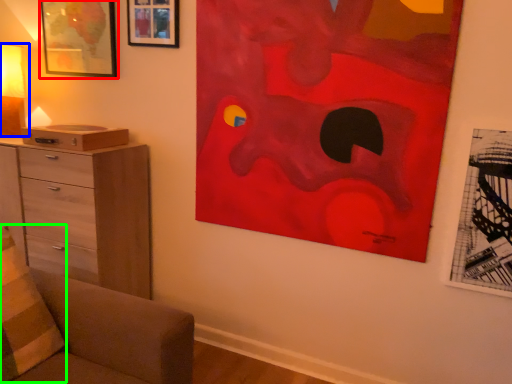
Question: Which is nearer to the picture frame (highlighted by a red box)? table lamp (highlighted by a blue box) or pillow (highlighted by a green box).

Choices:
 (A) table lamp
 (B) pillow

Answer: (A)